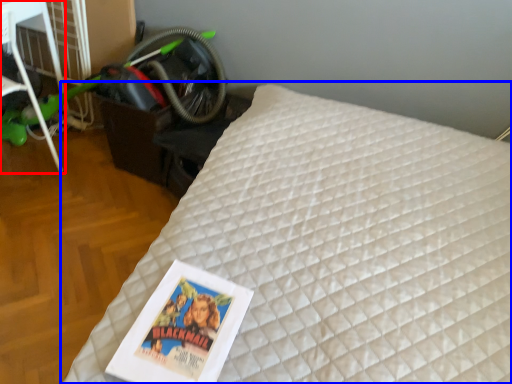
Question: Which point is further to the camera, furniture (highlighted by a red box) or bed (highlighted by a blue box)?

Choices:
 (A) furniture
 (B) bed

Answer: (A)